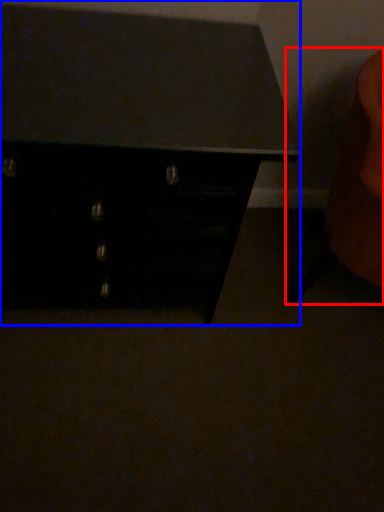
Question: Which point is further to the camera, swivel chair (highlighted by a red box) or chest of drawers (highlighted by a blue box)?

Choices:
 (A) swivel chair
 (B) chest of drawers

Answer: (A)